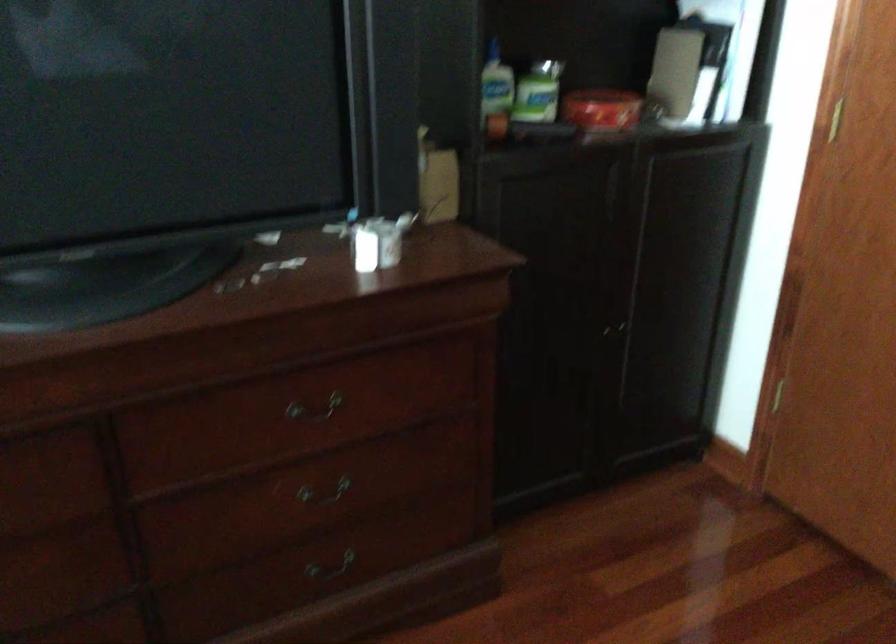
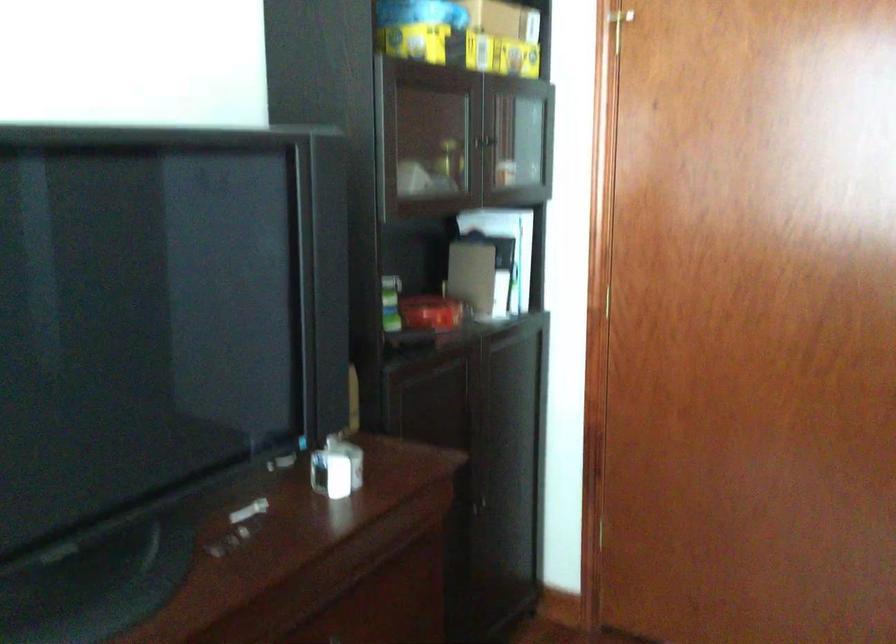
In the second image, find the point that corresponds to point 712,69 in the first image.

(503, 272)